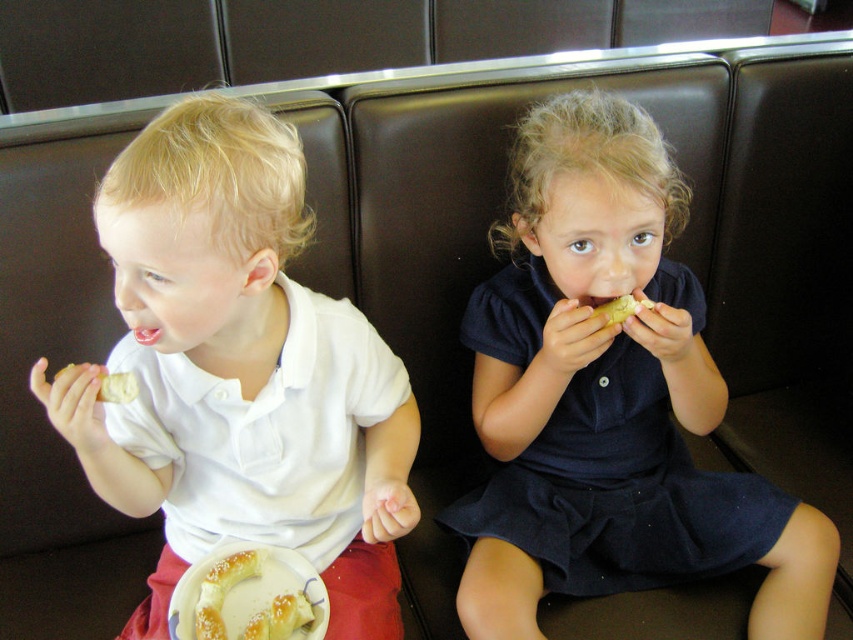
Can you confirm if white matte shirt at left is thinner than dark blue dress at center?

Yes, white matte shirt at left is thinner than dark blue dress at center.

What do you see at coordinates (239, 371) in the screenshot? Image resolution: width=853 pixels, height=640 pixels. I see `white matte shirt at left` at bounding box center [239, 371].

The height and width of the screenshot is (640, 853). What are the coordinates of `white matte shirt at left` in the screenshot? It's located at (239, 371).

Does dark blue dress at center come behind yellow matte pastry at upper center?

No, dark blue dress at center is closer to the viewer.

Is point (521, 412) more distant than point (646, 304)?

That is True.

The width and height of the screenshot is (853, 640). I want to click on dark blue dress at center, so click(608, 397).

Is white matte shirt at left positioned behind white crumbly pastry at upper left?

No.

Does white matte shirt at left appear on the right side of white crumbly pastry at upper left?

Yes, white matte shirt at left is to the right of white crumbly pastry at upper left.

Is point (263, 493) in front of point (62, 371)?

No, (263, 493) is behind (62, 371).

Where is `white matte shirt at left`? The height and width of the screenshot is (640, 853). white matte shirt at left is located at coordinates (239, 371).